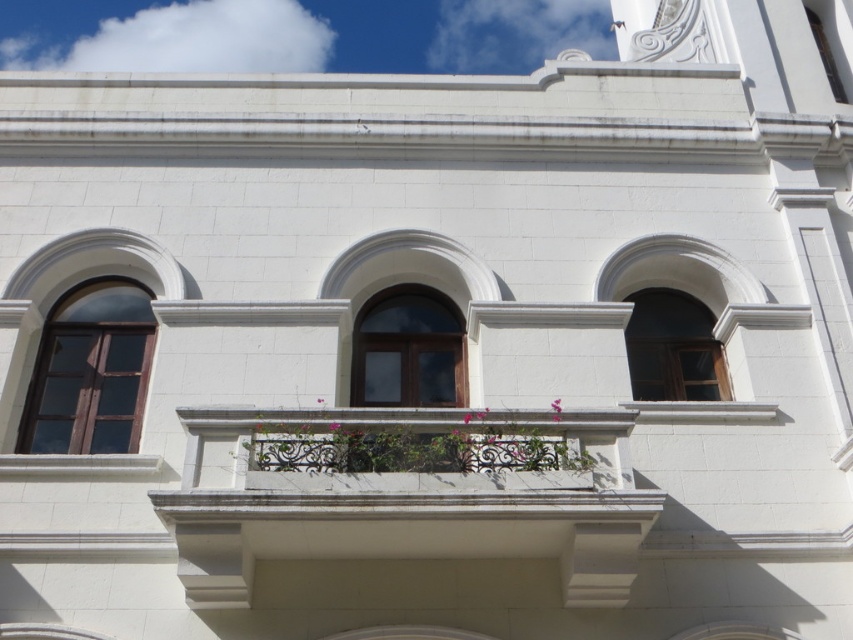
You are standing in front of the classical building and want to take a photo. You notice two points on the facade marked as point 1 at coordinates point (397, 305) and point 2 at coordinates point (335, 428). Which point is closer to your camera lens?

Point (397, 305) is further to the camera than point (335, 428), so point (335, 428) is closer to the camera lens.